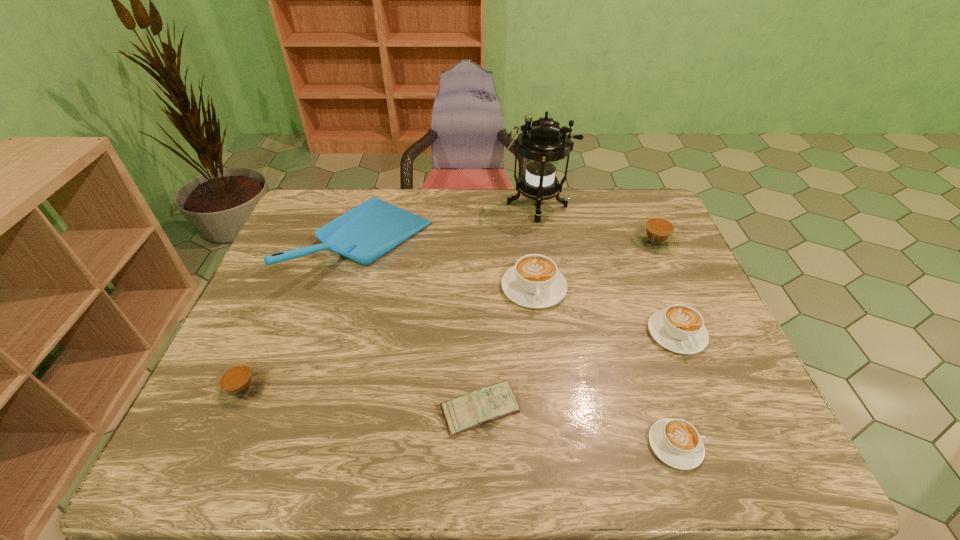
Where is `the tallest object`? the tallest object is located at coordinates (542, 143).

Identify the location of black lantern. (542, 143).

Locate an element on the screen. The width and height of the screenshot is (960, 540). the second tallest object is located at coordinates (365, 233).

Locate an element on the screen. The width and height of the screenshot is (960, 540). the farthest cappuccino is located at coordinates (657, 235).

Where is `the farther brown cappuccino`? This screenshot has height=540, width=960. the farther brown cappuccino is located at coordinates (657, 235).

Find the location of a particular element. The height and width of the screenshot is (540, 960). the leftmost white cappuccino is located at coordinates (534, 282).

Where is `the biggest white cappuccino`? Image resolution: width=960 pixels, height=540 pixels. the biggest white cappuccino is located at coordinates (534, 282).

Identify the location of the second smallest white cappuccino. (679, 328).

At what (x,y) coordinates should I click in order to perform the action: click on the fourth farthest cappuccino. Please return your answer as a coordinate pair (x, y). The width and height of the screenshot is (960, 540). Looking at the image, I should click on (238, 383).

Find the location of a particular element. The height and width of the screenshot is (540, 960). the left brown cappuccino is located at coordinates (238, 383).